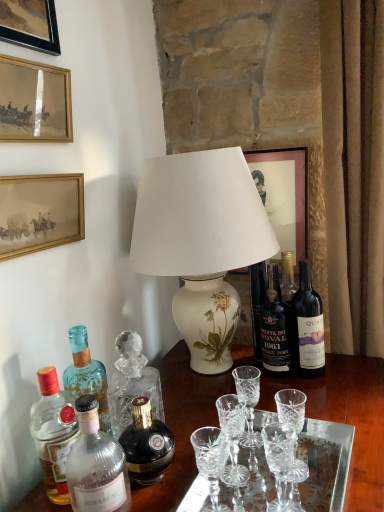
In order to click on matte white picture frame at upper center, arranged as the 1th picture frame when viewed from the right in this screenshot , I will do `click(283, 194)`.

What is the approximate height of clear crystal tray at center?

clear crystal tray at center is 5.85 centimeters tall.

The image size is (384, 512). I want to click on shiny dark glass bottle at center, marked as the third bottle in a right-to-left arrangement, so click(146, 444).

Considering the sizes of objects translucent glass bottle at left, positioned as the 1th bottle in left-to-right order, and clear crystal tray at center in the image provided, who is wider, translucent glass bottle at left, positioned as the 1th bottle in left-to-right order, or clear crystal tray at center?

clear crystal tray at center is wider.

Is translucent glass bottle at left, positioned as the 1th bottle in left-to-right order, not near clear crystal tray at center?

No.

Where is `the 3rd bottle behind the clear crystal tray at center, counting from the anchor's position`? The height and width of the screenshot is (512, 384). the 3rd bottle behind the clear crystal tray at center, counting from the anchor's position is located at coordinates (87, 375).

Is translucent glass bottle at left, positioned as the 1th bottle in left-to-right order, smaller than clear crystal tray at center?

Correct, translucent glass bottle at left, positioned as the 1th bottle in left-to-right order, occupies less space than clear crystal tray at center.

Between gold-framed painting at upper left, the 2th picture frame positioned from the left, and dark glass bottle at right, acting as the first bottle starting from the right, which one has larger width?

dark glass bottle at right, acting as the first bottle starting from the right.

Consider the image. In terms of height, does gold-framed painting at upper left, which appears as the third picture frame when viewed from the right, look taller or shorter compared to dark glass bottle at right, acting as the first bottle starting from the right?

gold-framed painting at upper left, which appears as the third picture frame when viewed from the right, is shorter than dark glass bottle at right, acting as the first bottle starting from the right.

From the image's perspective, which object appears higher, gold-framed painting at upper left, the 2th picture frame positioned from the left, or dark glass bottle at right, marked as the 5th bottle in a left-to-right arrangement?

gold-framed painting at upper left, the 2th picture frame positioned from the left.

Is gold-framed painting at upper left, the 2th picture frame positioned from the left, positioned behind dark glass bottle at right, acting as the first bottle starting from the right?

No, gold-framed painting at upper left, the 2th picture frame positioned from the left, is in front of dark glass bottle at right, acting as the first bottle starting from the right.

Is clear glass bottle at lower left, which is the fourth bottle from right to left, far away from wooden picture frame at upper left, acting as the fourth picture frame starting from the right?

Actually, clear glass bottle at lower left, which is the fourth bottle from right to left, and wooden picture frame at upper left, acting as the fourth picture frame starting from the right, are a little close together.

From their relative heights in the image, would you say clear glass bottle at lower left, the 2th bottle in the left-to-right sequence, is taller or shorter than wooden picture frame at upper left, acting as the fourth picture frame starting from the right?

Clearly, clear glass bottle at lower left, the 2th bottle in the left-to-right sequence, is shorter compared to wooden picture frame at upper left, acting as the fourth picture frame starting from the right.

Can you confirm if clear glass bottle at lower left, which is the fourth bottle from right to left, is positioned to the left of wooden picture frame at upper left, acting as the fourth picture frame starting from the right?

In fact, clear glass bottle at lower left, which is the fourth bottle from right to left, is to the right of wooden picture frame at upper left, acting as the fourth picture frame starting from the right.

Looking at the image, does clear glass bottle at lower left, which is the fourth bottle from right to left, seem bigger or smaller compared to wooden picture frame at upper left, acting as the fourth picture frame starting from the right?

clear glass bottle at lower left, which is the fourth bottle from right to left, is smaller than wooden picture frame at upper left, acting as the fourth picture frame starting from the right.

In the scene shown: From a real-world perspective, which is physically above, clear crystal tray at center or clear glass bottle at lower left, which is the fourth bottle from right to left?

From a 3D spatial view, clear glass bottle at lower left, which is the fourth bottle from right to left, is above.

Is clear glass bottle at lower left, which is the fourth bottle from right to left, surrounded by clear crystal tray at center?

No, clear glass bottle at lower left, which is the fourth bottle from right to left, is located outside of clear crystal tray at center.

In the scene shown: Is clear crystal tray at center directly adjacent to clear glass bottle at lower left, which is the fourth bottle from right to left?

clear crystal tray at center is not next to clear glass bottle at lower left, which is the fourth bottle from right to left, and they're not touching.

Considering the sizes of clear crystal tray at center and clear glass bottle at lower left, the 2th bottle in the left-to-right sequence, in the image, is clear crystal tray at center wider or thinner than clear glass bottle at lower left, the 2th bottle in the left-to-right sequence,?

Considering their sizes, clear crystal tray at center looks broader than clear glass bottle at lower left, the 2th bottle in the left-to-right sequence.

Looking at this image, how far apart are matte white picture frame at upper center, arranged as the 1th picture frame when viewed from the right, and dark blue glass bottle at center, the 4th bottle positioned from the left?

matte white picture frame at upper center, arranged as the 1th picture frame when viewed from the right, is 13.20 inches from dark blue glass bottle at center, the 4th bottle positioned from the left.

Is matte white picture frame at upper center, arranged as the 1th picture frame when viewed from the right, facing towards dark blue glass bottle at center, the 4th bottle positioned from the left?

Yes.

Based on the photo, from the image's perspective, is matte white picture frame at upper center, which is the 4th picture frame from left to right, positioned above or below dark blue glass bottle at center, acting as the second bottle starting from the right?

matte white picture frame at upper center, which is the 4th picture frame from left to right, is situated higher than dark blue glass bottle at center, acting as the second bottle starting from the right, in the image.

Do you think matte white picture frame at upper center, arranged as the 1th picture frame when viewed from the right, is within dark blue glass bottle at center, the 4th bottle positioned from the left, or outside of it?

matte white picture frame at upper center, arranged as the 1th picture frame when viewed from the right, exists outside the volume of dark blue glass bottle at center, the 4th bottle positioned from the left.

Is point (209, 452) farther from viewer compared to point (62, 101)?

No, it is in front of (62, 101).

Does clear crystal wine glass at center come behind gold-framed painting at upper left, the 2th picture frame positioned from the left?

Yes, it is behind gold-framed painting at upper left, the 2th picture frame positioned from the left.

Between clear crystal wine glass at center and gold-framed painting at upper left, the 2th picture frame positioned from the left, which one has larger size?

Bigger between the two is gold-framed painting at upper left, the 2th picture frame positioned from the left.

Looking at this image, is clear crystal wine glass at center turned away from gold-framed painting at upper left, which appears as the third picture frame when viewed from the right?

No, clear crystal wine glass at center's orientation is not away from gold-framed painting at upper left, which appears as the third picture frame when viewed from the right.

Is shiny dark glass bottle at center, marked as the third bottle in a right-to-left arrangement, looking in the opposite direction of gold-framed painting at upper left, the 2th picture frame positioned from the left?

No, shiny dark glass bottle at center, marked as the third bottle in a right-to-left arrangement, is not facing the opposite direction of gold-framed painting at upper left, the 2th picture frame positioned from the left.

From the image's perspective, which object appears higher, shiny dark glass bottle at center, the third bottle when ordered from left to right, or gold-framed painting at upper left, the 2th picture frame positioned from the left?

gold-framed painting at upper left, the 2th picture frame positioned from the left, is shown above in the image.

Can you tell me how much shiny dark glass bottle at center, marked as the third bottle in a right-to-left arrangement, and gold-framed painting at upper left, the 2th picture frame positioned from the left, differ in facing direction?

0.663 degrees separate the facing orientations of shiny dark glass bottle at center, marked as the third bottle in a right-to-left arrangement, and gold-framed painting at upper left, the 2th picture frame positioned from the left.

Between shiny dark glass bottle at center, the third bottle when ordered from left to right, and gold-framed painting at upper left, the 2th picture frame positioned from the left, which one appears on the left side from the viewer's perspective?

gold-framed painting at upper left, the 2th picture frame positioned from the left, is more to the left.

Identify the location of glass plate that is under the translucent glass bottle at left, positioned as the 1th bottle in left-to-right order (from a real-world perspective). (325, 464).

I want to click on the 3rd picture frame above the dark glass bottle at right, acting as the first bottle starting from the right (from the image's perspective), so click(34, 102).

Which object lies nearer to the anchor point wooden picture frame at upper left, acting as the fourth picture frame starting from the right, dark blue glass bottle at center, acting as the second bottle starting from the right, or white porcelain lamp at center?

The object closer to wooden picture frame at upper left, acting as the fourth picture frame starting from the right, is white porcelain lamp at center.

When comparing their distances from wooden picture frame at upper left, acting as the fourth picture frame starting from the right, does shiny dark glass bottle at center, the third bottle when ordered from left to right, or clear glass bottle at lower left, which is the fourth bottle from right to left, seem further?

shiny dark glass bottle at center, the third bottle when ordered from left to right, is positioned further to the anchor wooden picture frame at upper left, acting as the fourth picture frame starting from the right.

Looking at the image, which one is located closer to dark blue glass bottle at center, the 4th bottle positioned from the left, matte white picture frame at upper center, which is the 4th picture frame from left to right, or gold-framed painting at upper left, which appears as the third picture frame when viewed from the right?

matte white picture frame at upper center, which is the 4th picture frame from left to right, lies closer to dark blue glass bottle at center, the 4th bottle positioned from the left, than the other object.

When comparing their distances from shiny dark glass bottle at center, marked as the third bottle in a right-to-left arrangement, does clear crystal wine glass at center or clear glass bottle at lower left, the 2th bottle in the left-to-right sequence, seem further?

Based on the image, clear crystal wine glass at center appears to be further to shiny dark glass bottle at center, marked as the third bottle in a right-to-left arrangement.

Considering their positions, is dark blue glass bottle at center, the 4th bottle positioned from the left, positioned closer to gold-framed painting at upper left, the 2th picture frame positioned from the left, than matte white picture frame at upper center, which is the 4th picture frame from left to right?

Result: dark blue glass bottle at center, the 4th bottle positioned from the left, is positioned closer to the anchor gold-framed painting at upper left, the 2th picture frame positioned from the left.

From the image, which object appears to be nearer to dark blue glass bottle at center, acting as the second bottle starting from the right, wooden picture frame at upper left, acting as the fourth picture frame starting from the right, or dark glass bottle at right, acting as the first bottle starting from the right?

dark glass bottle at right, acting as the first bottle starting from the right, lies closer to dark blue glass bottle at center, acting as the second bottle starting from the right, than the other object.

Consider the image. Considering their positions, is dark blue glass bottle at center, the 4th bottle positioned from the left, positioned closer to shiny dark glass bottle at center, the third bottle when ordered from left to right, than gold-framed picture at upper left, which appears as the 2th picture frame when viewed from the right?

dark blue glass bottle at center, the 4th bottle positioned from the left, is closer to shiny dark glass bottle at center, the third bottle when ordered from left to right.

Looking at the image, which one is located further to shiny dark glass bottle at center, marked as the third bottle in a right-to-left arrangement, clear crystal wine glass at center or dark glass bottle at right, marked as the 5th bottle in a left-to-right arrangement?

Among the two, dark glass bottle at right, marked as the 5th bottle in a left-to-right arrangement, is located further to shiny dark glass bottle at center, marked as the third bottle in a right-to-left arrangement.

This screenshot has width=384, height=512. I want to click on lamp that lies between wooden picture frame at upper left, which is the first picture frame in left-to-right order, and translucent glass bottle at left, which is the 5th bottle in right-to-left order, from top to bottom, so click(201, 242).

Identify the location of glass plate between gold-framed picture at upper left, which appears as the 2th picture frame when viewed from the right, and dark blue glass bottle at center, acting as the second bottle starting from the right. This screenshot has height=512, width=384. (325, 464).

This screenshot has height=512, width=384. What are the coordinates of `bottle between wooden picture frame at upper left, which is the first picture frame in left-to-right order, and dark blue glass bottle at center, the 4th bottle positioned from the left, in the vertical direction` in the screenshot? It's located at (307, 326).

At what (x,y) coordinates should I click in order to perform the action: click on picture frame between translucent glass bottle at left, positioned as the 1th bottle in left-to-right order, and dark glass bottle at right, acting as the first bottle starting from the right. Please return your answer as a coordinate pair (x, y). This screenshot has height=512, width=384. Looking at the image, I should click on (283, 194).